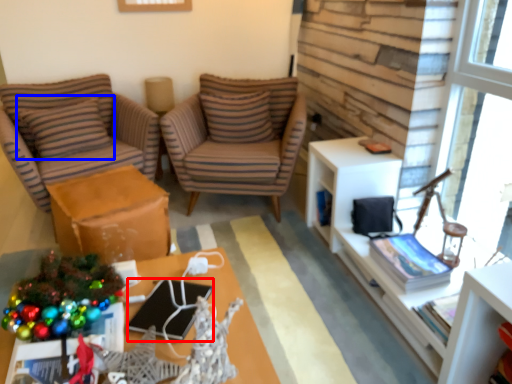
Question: Among these objects, which one is farthest to the camera, laptop (highlighted by a red box) or pillow (highlighted by a blue box)?

Choices:
 (A) laptop
 (B) pillow

Answer: (B)